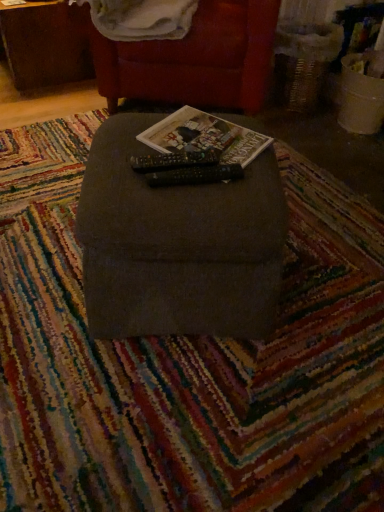
Question: From the image's perspective, is brown wood table at upper left positioned above or below white soft blanket at upper center?

Choices:
 (A) above
 (B) below

Answer: (A)

Question: Is brown wood table at upper left in front of or behind white soft blanket at upper center in the image?

Choices:
 (A) front
 (B) behind

Answer: (B)

Question: Which object is positioned farthest from the dark gray fabric ottoman at center, which appears as the second furniture when viewed from the back?

Choices:
 (A) matte paper magazine at center
 (B) white soft blanket at upper center
 (C) brown wood table at upper left
 (D) velvet red armchair at upper center, the 1th furniture viewed from the top

Answer: (C)

Question: Estimate the real-world distances between objects in this image. Which object is farther from the velvet red armchair at upper center, which appears as the 1th furniture when viewed from the back?

Choices:
 (A) brown wood table at upper left
 (B) matte paper magazine at center
 (C) white soft blanket at upper center
 (D) dark gray fabric ottoman at center, the first furniture in the bottom-to-top sequence

Answer: (D)